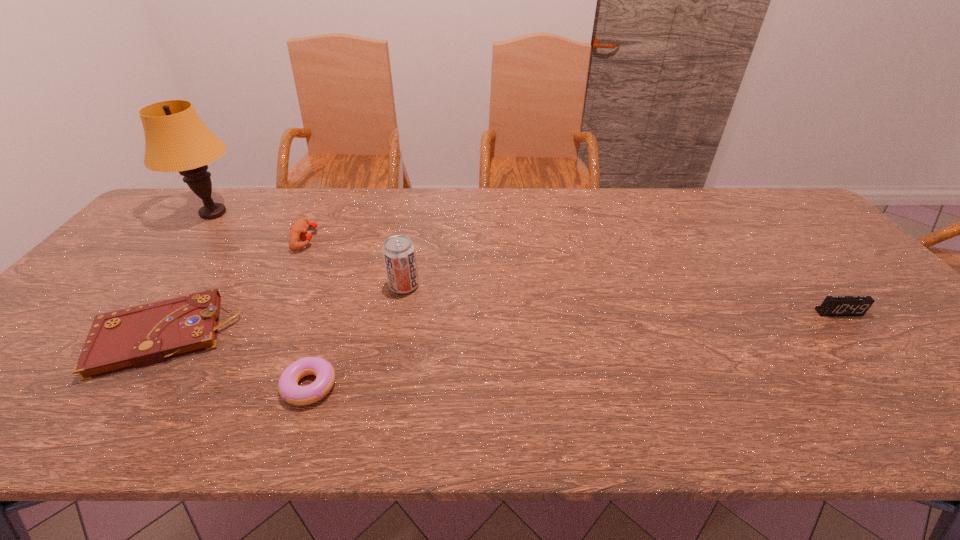
This screenshot has width=960, height=540. Find the location of `vacant area that lies between the third object from left to right and the tallest object`. vacant area that lies between the third object from left to right and the tallest object is located at coordinates click(260, 226).

You are a GUI agent. You are given a task and a screenshot of the screen. Output one action in this format:
    pyautogui.click(x=<x>, y=<y>)
    Task: Click on the free space between the rightmost object and the lampshade
    Image resolution: width=960 pixels, height=540 pixels.
    Given the screenshot: What is the action you would take?
    pyautogui.click(x=526, y=263)

The width and height of the screenshot is (960, 540). Identify the location of vacant space in between the second tallest object and the third object from right to left. (356, 335).

Find the location of a particular element. The height and width of the screenshot is (540, 960). vacant space in between the puncher and the notebook is located at coordinates (234, 288).

Choose which object is the third nearest neighbor to the alarm clock. Please provide its 2D coordinates. Your answer should be formatted as a tuple, i.e. [(x, y)], where the tuple contains the x and y coordinates of a point satisfying the conditions above.

[(298, 231)]

Locate an element on the screen. Image resolution: width=960 pixels, height=540 pixels. object identified as the fifth closest to the soda can is located at coordinates (832, 305).

What are the coordinates of `free space that satisfies the following two spatial constraints: 1. with the gloves of the third object from left to right facing forward; 2. on the left side of the soda can` in the screenshot? It's located at (283, 285).

Locate an element on the screen. This screenshot has height=540, width=960. free space in the image that satisfies the following two spatial constraints: 1. with the gloves of the fourth object from left to right facing forward; 2. on the right side of the third object from left to right is located at coordinates (233, 386).